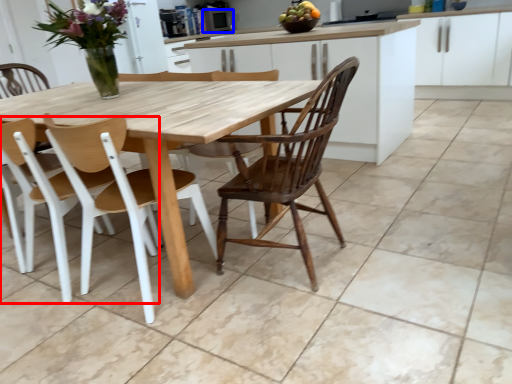
Question: Which object appears farthest to the camera in this image, chair (highlighted by a red box) or appliance (highlighted by a blue box)?

Choices:
 (A) chair
 (B) appliance

Answer: (B)